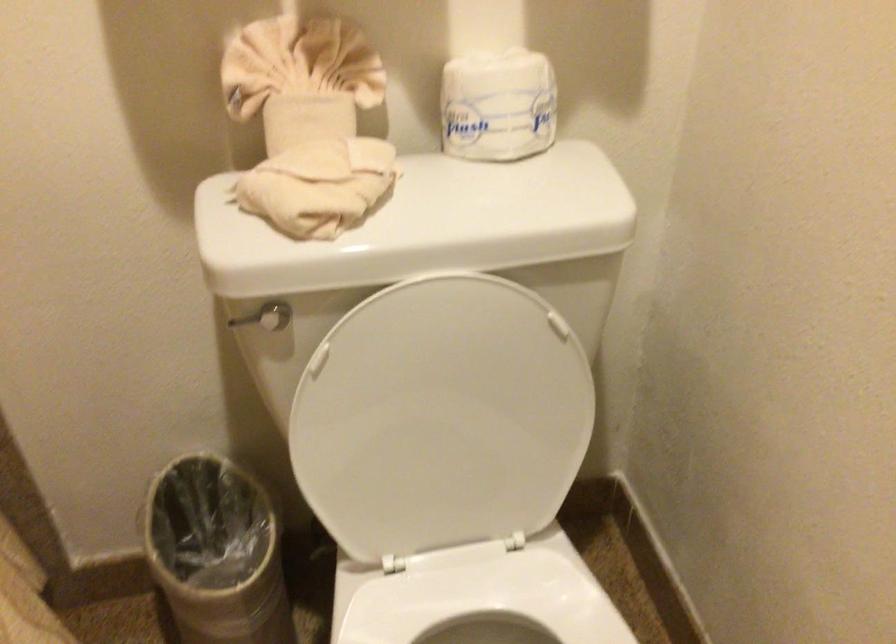
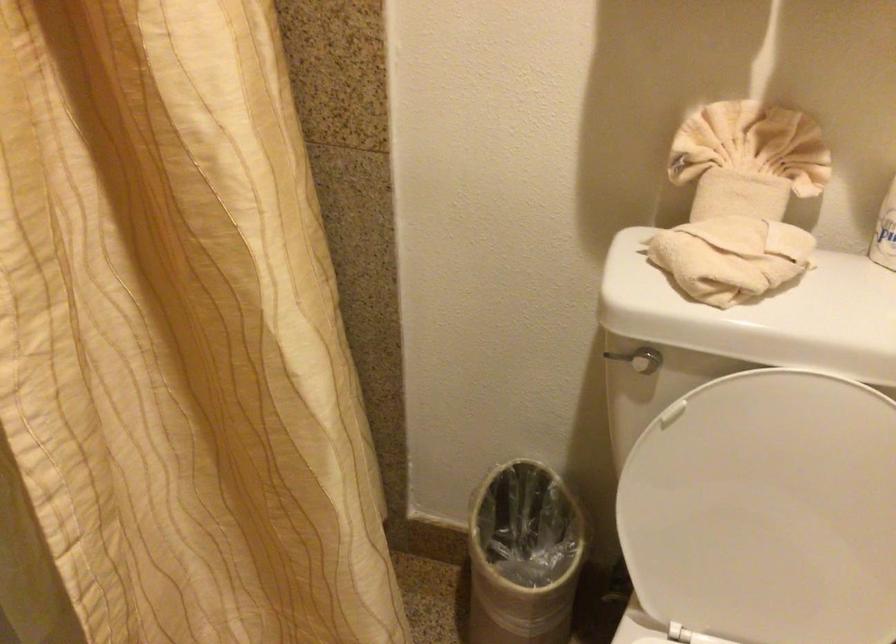
In the second image, find the point that corresponds to the point at 246,321 in the first image.

(616, 357)